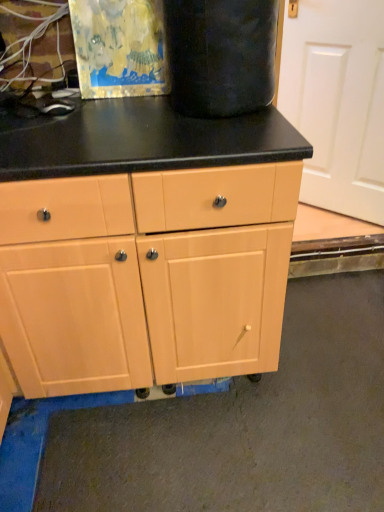
Measure the distance between point (32, 192) and camera.

Point (32, 192) is 94.50 centimeters from camera.

This screenshot has height=512, width=384. In order to click on matte wood cabinet at center in this screenshot , I will do `click(145, 276)`.

Measure the distance between matte wood cabinet at center and camera.

They are 36.82 inches apart.

The width and height of the screenshot is (384, 512). What do you see at coordinates (145, 276) in the screenshot? I see `matte wood cabinet at center` at bounding box center [145, 276].

Identify the location of white matte screen door at upper right. The height and width of the screenshot is (512, 384). (337, 102).

This screenshot has height=512, width=384. Describe the element at coordinates (337, 102) in the screenshot. I see `white matte screen door at upper right` at that location.

I want to click on matte wood cabinet at center, so click(x=145, y=276).

Considering the positions of objects white matte screen door at upper right and matte wood cabinet at center in the image provided, who is more to the left, white matte screen door at upper right or matte wood cabinet at center?

Positioned to the left is matte wood cabinet at center.

Who is more distant, white matte screen door at upper right or matte wood cabinet at center?

white matte screen door at upper right is more distant.

Is point (295, 103) positioned after point (12, 293)?

That is True.

From the image's perspective, which one is positioned lower, white matte screen door at upper right or matte wood cabinet at center?

matte wood cabinet at center appears lower in the image.

From a real-world perspective, who is located higher, white matte screen door at upper right or matte wood cabinet at center?

In real-world perspective, white matte screen door at upper right is above.

Is white matte screen door at upper right wider or thinner than matte wood cabinet at center?

Clearly, white matte screen door at upper right has less width compared to matte wood cabinet at center.

Who is shorter, white matte screen door at upper right or matte wood cabinet at center?

matte wood cabinet at center.

Does white matte screen door at upper right have a smaller size compared to matte wood cabinet at center?

Yes, white matte screen door at upper right is smaller than matte wood cabinet at center.

Is white matte screen door at upper right positioned beyond the bounds of matte wood cabinet at center?

Yes, white matte screen door at upper right is located beyond the bounds of matte wood cabinet at center.

Can you see white matte screen door at upper right touching matte wood cabinet at center?

No, white matte screen door at upper right is not with matte wood cabinet at center.

From the picture: Is white matte screen door at upper right facing away from matte wood cabinet at center?

That's not correct — white matte screen door at upper right is not looking away from matte wood cabinet at center.

Can you tell me how much white matte screen door at upper right and matte wood cabinet at center differ in facing direction?

The facing directions of white matte screen door at upper right and matte wood cabinet at center are 44.3 degrees apart.

Find the location of a particular element. chest of drawers below the white matte screen door at upper right (from the image's perspective) is located at coordinates [x=145, y=276].

Which object is positioned more to the left, matte wood cabinet at center or white matte screen door at upper right?

From the viewer's perspective, matte wood cabinet at center appears more on the left side.

In the image, is matte wood cabinet at center positioned in front of or behind white matte screen door at upper right?

matte wood cabinet at center is in front of white matte screen door at upper right.

Does point (260, 253) lie in front of point (380, 96)?

Yes, point (260, 253) is closer to viewer.

Based on the photo, from the image's perspective, is matte wood cabinet at center on white matte screen door at upper right?

No, from the image's perspective, matte wood cabinet at center is not above white matte screen door at upper right.

From a real-world perspective, relative to white matte screen door at upper right, is matte wood cabinet at center vertically above or below?

From a real-world perspective, matte wood cabinet at center is physically below white matte screen door at upper right.

Considering the relative sizes of matte wood cabinet at center and white matte screen door at upper right in the image provided, is matte wood cabinet at center thinner than white matte screen door at upper right?

In fact, matte wood cabinet at center might be wider than white matte screen door at upper right.

Between matte wood cabinet at center and white matte screen door at upper right, which one has less height?

matte wood cabinet at center.

Between matte wood cabinet at center and white matte screen door at upper right, which one has smaller size?

white matte screen door at upper right is smaller.

Do you think matte wood cabinet at center is within white matte screen door at upper right, or outside of it?

matte wood cabinet at center is not inside white matte screen door at upper right, it's outside.

Would you say matte wood cabinet at center is a long distance from white matte screen door at upper right?

Absolutely, matte wood cabinet at center is distant from white matte screen door at upper right.

Could you tell me if matte wood cabinet at center is facing white matte screen door at upper right?

No, matte wood cabinet at center does not turn towards white matte screen door at upper right.

Can you tell me how much matte wood cabinet at center and white matte screen door at upper right differ in facing direction?

matte wood cabinet at center and white matte screen door at upper right are facing 44.3 degrees away from each other.

Find the location of `screen door lying on the right of matte wood cabinet at center`. screen door lying on the right of matte wood cabinet at center is located at coordinates (337, 102).

Locate an element on the screen. chest of drawers below the white matte screen door at upper right (from a real-world perspective) is located at coordinates pos(145,276).

Where is `screen door above the matte wood cabinet at center (from the image's perspective)`? The height and width of the screenshot is (512, 384). screen door above the matte wood cabinet at center (from the image's perspective) is located at coordinates (337, 102).